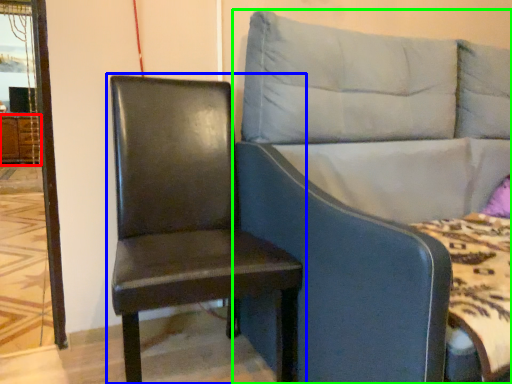
Question: Estimate the real-world distances between objects in this image. Which object is farther from dresser (highlighted by a red box), chair (highlighted by a blue box) or studio couch (highlighted by a green box)?

Choices:
 (A) chair
 (B) studio couch

Answer: (B)